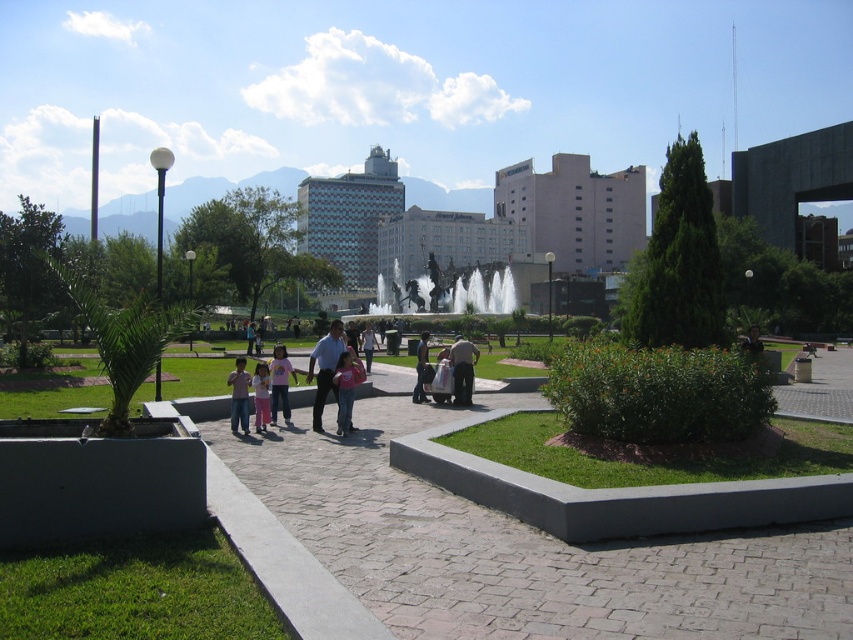
Question: Which of the following is the closest to the observer?

Choices:
 (A) light blue shirt at center
 (B) pink fabric shirt at center
 (C) pink cotton shirt at center
 (D) pink fabric dress at center

Answer: (A)

Question: Is light blue shirt at center thinner than pink fabric at center?

Choices:
 (A) no
 (B) yes

Answer: (A)

Question: Is light blue shirt at center positioned before light pink cotton shirt at center?

Choices:
 (A) no
 (B) yes

Answer: (B)

Question: Which of the following is the closest to the observer?

Choices:
 (A) (456, 353)
 (B) (283, 344)
 (C) (418, 348)

Answer: (A)

Question: From the image, what is the correct spatial relationship of dark blue jeans at center in relation to light pink cotton shirt at center?

Choices:
 (A) below
 (B) above

Answer: (B)

Question: Among these points, which one is nearest to the camera?

Choices:
 (A) (256, 419)
 (B) (318, 408)
 (C) (437, 291)

Answer: (B)